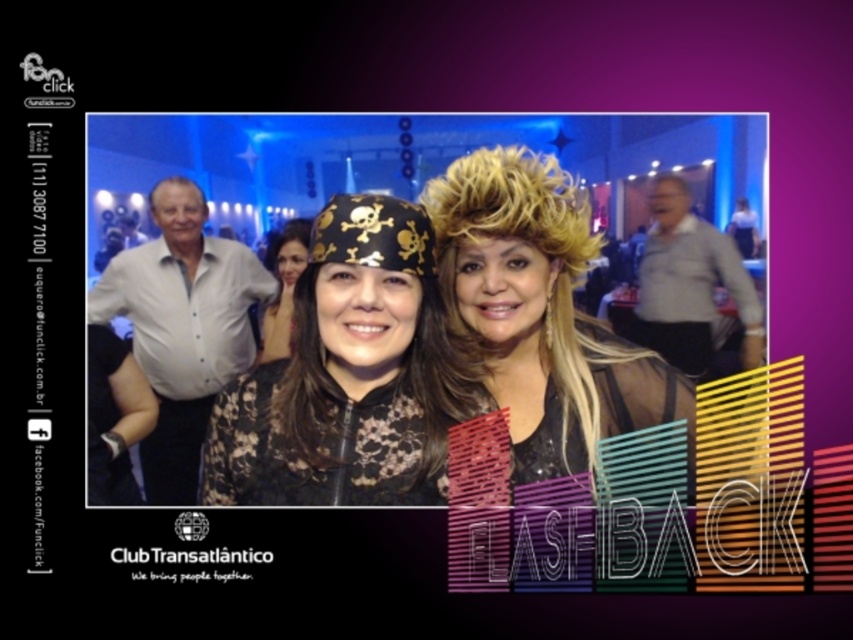
Who is lower down, black lace dress at center or gray cotton shirt at right?

black lace dress at center is below.

Does black lace dress at center have a lesser height compared to gray cotton shirt at right?

Incorrect, black lace dress at center's height does not fall short of gray cotton shirt at right's.

Describe the element at coordinates (349, 376) in the screenshot. The width and height of the screenshot is (853, 640). I see `black lace dress at center` at that location.

Identify the location of black lace dress at center. (x=349, y=376).

Who is more distant from viewer, (x=680, y=257) or (x=306, y=228)?

The point (x=306, y=228) is more distant.

Can you confirm if gray cotton shirt at right is positioned to the left of matte black headscarf at center?

No, gray cotton shirt at right is not to the left of matte black headscarf at center.

The height and width of the screenshot is (640, 853). Describe the element at coordinates (689, 284) in the screenshot. I see `gray cotton shirt at right` at that location.

The image size is (853, 640). I want to click on gray cotton shirt at right, so click(689, 284).

Is point (219, 483) more distant than point (236, 324)?

That is False.

Is black lace dress at center positioned before white cotton shirt at left?

That is True.

Between point (405, 387) and point (164, 380), which one is positioned in front?

Point (405, 387) is more forward.

This screenshot has width=853, height=640. In order to click on black lace dress at center in this screenshot , I will do `click(349, 376)`.